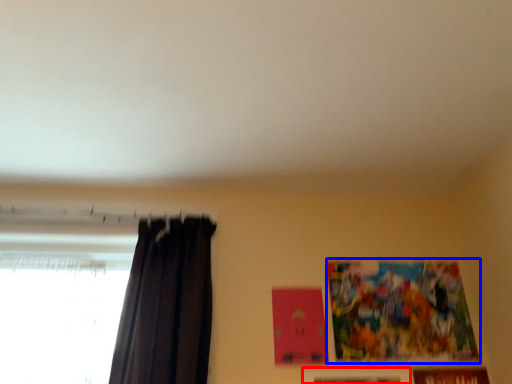
Question: Among these objects, which one is nearest to the camera, picture frame (highlighted by a red box) or picture frame (highlighted by a blue box)?

Choices:
 (A) picture frame
 (B) picture frame

Answer: (A)